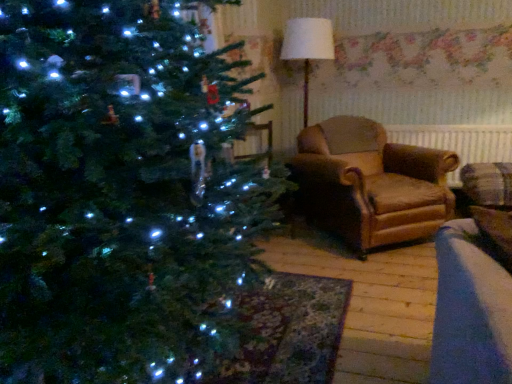
Question: Is the position of white fabric lampshade at upper center less distant than that of brown fabric radiator at right?

Choices:
 (A) no
 (B) yes

Answer: (B)

Question: Is white fabric lampshade at upper center looking in the opposite direction of brown fabric radiator at right?

Choices:
 (A) no
 (B) yes

Answer: (A)

Question: Does white fabric lampshade at upper center lie behind brown fabric radiator at right?

Choices:
 (A) no
 (B) yes

Answer: (A)

Question: Does white fabric lampshade at upper center appear on the left side of brown fabric radiator at right?

Choices:
 (A) no
 (B) yes

Answer: (B)

Question: From the image's perspective, is white fabric lampshade at upper center on brown fabric radiator at right?

Choices:
 (A) yes
 (B) no

Answer: (A)

Question: Is white fabric lampshade at upper center wider than brown fabric radiator at right?

Choices:
 (A) yes
 (B) no

Answer: (A)

Question: Is leather armchair at center at the right side of brown fabric radiator at right?

Choices:
 (A) yes
 (B) no

Answer: (B)

Question: Considering the relative sizes of leather armchair at center and brown fabric radiator at right in the image provided, is leather armchair at center thinner than brown fabric radiator at right?

Choices:
 (A) yes
 (B) no

Answer: (B)

Question: Is leather armchair at center at the left side of brown fabric radiator at right?

Choices:
 (A) yes
 (B) no

Answer: (A)

Question: Is leather armchair at center bigger than brown fabric radiator at right?

Choices:
 (A) no
 (B) yes

Answer: (B)

Question: Can you confirm if leather armchair at center is taller than brown fabric radiator at right?

Choices:
 (A) no
 (B) yes

Answer: (B)

Question: Could you tell me if leather armchair at center is turned towards brown fabric radiator at right?

Choices:
 (A) no
 (B) yes

Answer: (A)

Question: Is white fabric lampshade at upper center to the left of leather armchair at center from the viewer's perspective?

Choices:
 (A) yes
 (B) no

Answer: (A)